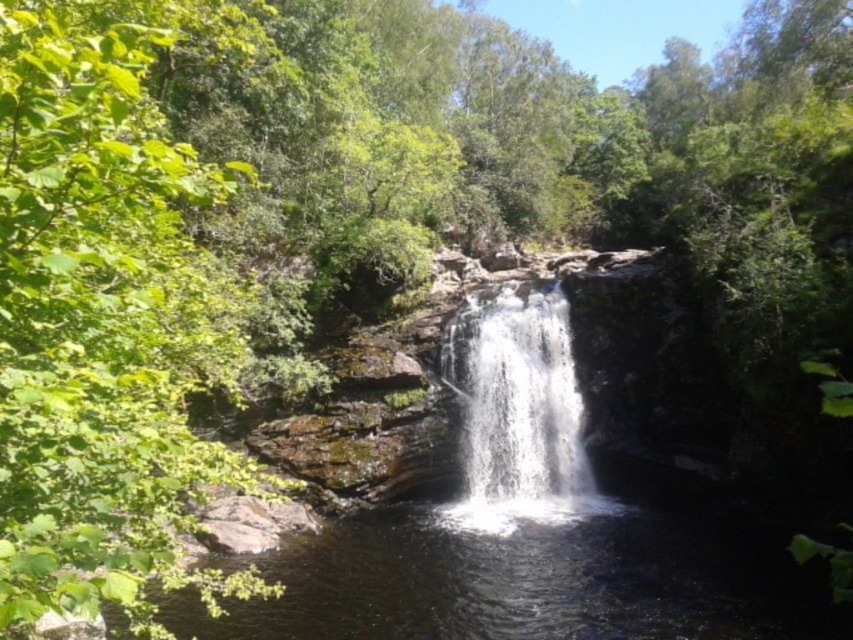
Between green leafy tree at left and white frothy water at center, which one is positioned lower?

white frothy water at center is lower down.

Is point (167, 218) in front of point (485, 465)?

Yes.

I want to click on green leafy tree at left, so (x=107, y=310).